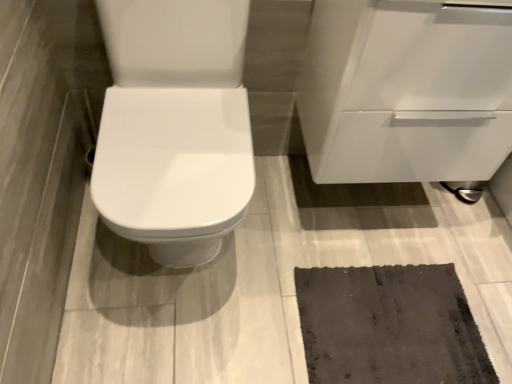
Image resolution: width=512 pixels, height=384 pixels. What are the coordinates of `free space below dark gray textured mat at lower right (from a real-world perspective)` in the screenshot? It's located at (381, 318).